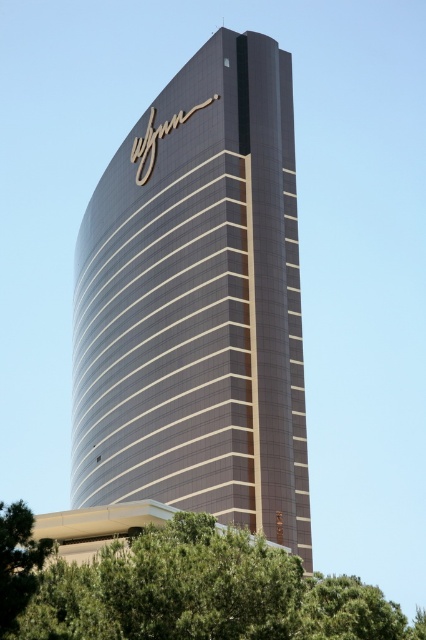
Question: Does glossy glass tower at center appear under green leafy tree at lower center?

Choices:
 (A) no
 (B) yes

Answer: (A)

Question: Among these objects, which one is nearest to the camera?

Choices:
 (A) glossy glass tower at center
 (B) green leafy tree at lower center

Answer: (B)

Question: Can you confirm if glossy glass tower at center is positioned to the left of green leafy tree at lower center?

Choices:
 (A) no
 (B) yes

Answer: (B)

Question: Which point appears farthest from the camera in this image?

Choices:
 (A) (425, 632)
 (B) (144, 140)

Answer: (B)

Question: Which object is closer to the camera taking this photo?

Choices:
 (A) glossy glass tower at center
 (B) green leafy tree at lower center

Answer: (B)

Question: Is glossy glass tower at center in front of green leafy tree at lower center?

Choices:
 (A) no
 (B) yes

Answer: (A)